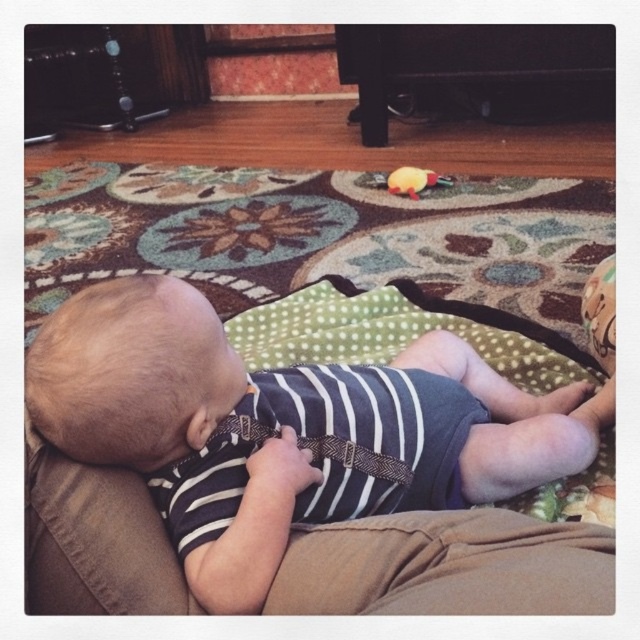
Question: Among these points, which one is farthest from the camera?

Choices:
 (A) (550, 557)
 (B) (394, 173)

Answer: (B)

Question: Which of the following is the farthest from the observer?

Choices:
 (A) (365, 525)
 (B) (264, 378)

Answer: (B)

Question: Is striped fabric baby at center below brown cotton pants at lower center?

Choices:
 (A) no
 (B) yes

Answer: (A)

Question: Can you confirm if striped fabric baby at center is positioned to the left of brown cotton pants at lower center?

Choices:
 (A) no
 (B) yes

Answer: (B)

Question: Considering the real-world distances, which object is farthest from the brown cotton pants at lower center?

Choices:
 (A) yellow rubber duck at center
 (B) striped fabric baby at center

Answer: (A)

Question: Can you confirm if brown cotton pants at lower center is smaller than yellow rubber duck at center?

Choices:
 (A) yes
 (B) no

Answer: (B)